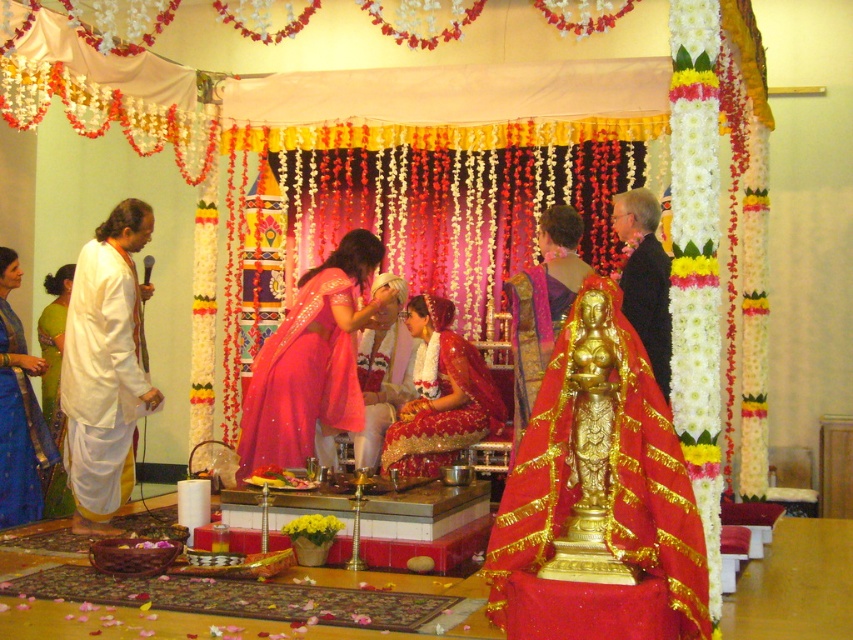
Question: Does gold metallic statue at center have a smaller size compared to green silk saree at left?

Choices:
 (A) yes
 (B) no

Answer: (A)

Question: Considering the real-world distances, which object is farthest from the green silk saree at left?

Choices:
 (A) shiny pink fabric at center
 (B) satin pink dress at center

Answer: (A)

Question: Can you confirm if satin pink dress at center is positioned to the left of matte red saree at center?

Choices:
 (A) no
 (B) yes

Answer: (B)

Question: Which of these objects is positioned closest to the gold metallic statue at center?

Choices:
 (A) gold shiny statue at center
 (B) green silk saree at left
 (C) shiny pink fabric at center

Answer: (A)

Question: Does satin pink dress at center have a larger size compared to white cotton robe at left?

Choices:
 (A) yes
 (B) no

Answer: (A)

Question: Considering the real-world distances, which object is closest to the satin pink dress at center?

Choices:
 (A) white cotton robe at left
 (B) blue silk saree at left
 (C) matte red saree at center
 (D) gold shiny statue at center

Answer: (A)